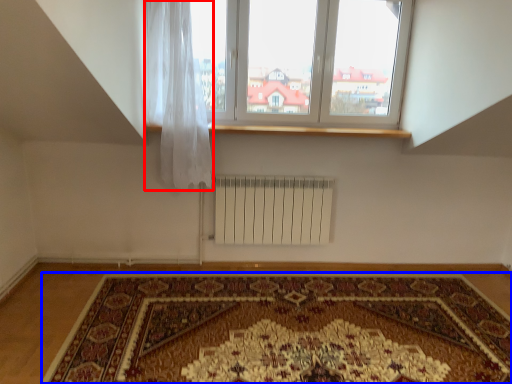
Question: Which object is further to the camera taking this photo, curtain (highlighted by a red box) or mat (highlighted by a blue box)?

Choices:
 (A) curtain
 (B) mat

Answer: (A)